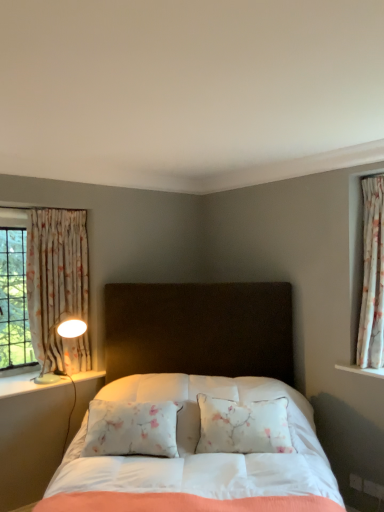
Describe the element at coordinates (198, 405) in the screenshot. I see `white fabric bed at center` at that location.

Image resolution: width=384 pixels, height=512 pixels. Describe the element at coordinates (25, 385) in the screenshot. I see `white glossy lamp at left` at that location.

This screenshot has height=512, width=384. What do you see at coordinates (372, 277) in the screenshot? I see `floral fabric curtain at right, the 1th curtain from the front` at bounding box center [372, 277].

Locate an element on the screen. This screenshot has height=512, width=384. floral fabric curtain at left, which is the 2th curtain in right-to-left order is located at coordinates (55, 271).

In order to click on white fabric bed at center in this screenshot , I will do `click(198, 405)`.

Starting from the white glossy lamp at left, which curtain is the 1st one to the right? Please provide its 2D coordinates.

[(55, 271)]

Does floral fabric curtain at left, which is the 2th curtain in right-to-left order, have a smaller size compared to white glossy lamp at left?

No.

Is floral fabric curtain at left, arranged as the 2th curtain when viewed from the front, touching white glossy lamp at left?

No.

Does floral fabric curtain at right, which is the 2th curtain from back to front, have a greater width compared to white fabric bed at center?

Incorrect, the width of floral fabric curtain at right, which is the 2th curtain from back to front, does not surpass that of white fabric bed at center.

Is floral fabric curtain at right, the 1th curtain from the front, positioned far away from white fabric bed at center?

Absolutely, floral fabric curtain at right, the 1th curtain from the front, is distant from white fabric bed at center.

Consider the image. Which is more to the right, floral fabric curtain at right, which is the 2th curtain from back to front, or white fabric bed at center?

Positioned to the right is floral fabric curtain at right, which is the 2th curtain from back to front.

Is floral fabric curtain at right, which is the second curtain in left-to-right order, turned away from floral fabric curtain at left, which is the first curtain in left-to-right order?

No.

Considering the positions of objects floral fabric curtain at right, arranged as the 1th curtain when viewed from the right, and floral fabric curtain at left, which is the first curtain in left-to-right order, in the image provided, who is more to the right, floral fabric curtain at right, arranged as the 1th curtain when viewed from the right, or floral fabric curtain at left, which is the first curtain in left-to-right order,?

From the viewer's perspective, floral fabric curtain at right, arranged as the 1th curtain when viewed from the right, appears more on the right side.

From a real-world perspective, relative to floral fabric curtain at left, acting as the first curtain starting from the back, is floral fabric curtain at right, the 1th curtain from the front, vertically above or below?

From a real-world perspective, floral fabric curtain at right, the 1th curtain from the front, is physically above floral fabric curtain at left, acting as the first curtain starting from the back.

From the image's perspective, is floral fabric curtain at right, which is the second curtain in left-to-right order, below floral fabric curtain at left, which is the 2th curtain in right-to-left order?

No, from the image's perspective, floral fabric curtain at right, which is the second curtain in left-to-right order, is not below floral fabric curtain at left, which is the 2th curtain in right-to-left order.

Is white fabric bed at center aimed at white glossy lamp at left?

No, white fabric bed at center is not turned towards white glossy lamp at left.

Does point (161, 489) lie behind point (40, 390)?

No.

Which of these two, white fabric bed at center or white glossy lamp at left, is bigger?

white fabric bed at center is bigger.

From the picture: Is white glossy lamp at left far from floral fabric curtain at right, which is the 2th curtain from back to front?

Indeed, white glossy lamp at left is not near floral fabric curtain at right, which is the 2th curtain from back to front.

Is floral fabric curtain at right, the 1th curtain from the front, a part of white glossy lamp at left?

No, white glossy lamp at left does not contain floral fabric curtain at right, the 1th curtain from the front.

Which object is thinner, white glossy lamp at left or floral fabric curtain at right, which is the 2th curtain from back to front?

floral fabric curtain at right, which is the 2th curtain from back to front.

Based on the photo, is white glossy lamp at left facing away from white fabric bed at center?

white glossy lamp at left is not turned away from white fabric bed at center.

Find the location of a particular element. window sill positioned vertically above the white fabric bed at center (from a real-world perspective) is located at coordinates (25, 385).

Between white glossy lamp at left and white fabric bed at center, which one is positioned in front?

white fabric bed at center is more forward.

From the image's perspective, which is below, white fabric bed at center or floral fabric curtain at right, which is the 2th curtain from back to front?

white fabric bed at center is shown below in the image.

Can floral fabric curtain at right, which is the 2th curtain from back to front, be found inside white fabric bed at center?

No, white fabric bed at center does not contain floral fabric curtain at right, which is the 2th curtain from back to front.

Which of these two, white fabric bed at center or floral fabric curtain at right, arranged as the 1th curtain when viewed from the right, is smaller?

floral fabric curtain at right, arranged as the 1th curtain when viewed from the right.

Where is `bed located underneath the floral fabric curtain at right, which is the 2th curtain from back to front (from a real-world perspective)`? Image resolution: width=384 pixels, height=512 pixels. bed located underneath the floral fabric curtain at right, which is the 2th curtain from back to front (from a real-world perspective) is located at coordinates (198, 405).

You are a GUI agent. You are given a task and a screenshot of the screen. Output one action in this format:
    pyautogui.click(x=<x>, y=<y>)
    Task: Click on the window sill on the left side of floral fabric curtain at left, which is the first curtain in left-to-right order
    
    Given the screenshot: What is the action you would take?
    pyautogui.click(x=25, y=385)

Where is `the 2nd curtain directly above the white fabric bed at center (from a real-world perspective)`? This screenshot has height=512, width=384. the 2nd curtain directly above the white fabric bed at center (from a real-world perspective) is located at coordinates (372, 277).

From the image, which object appears to be farther from white fabric bed at center, floral fabric curtain at right, arranged as the 1th curtain when viewed from the right, or white glossy lamp at left?

Based on the image, floral fabric curtain at right, arranged as the 1th curtain when viewed from the right, appears to be further to white fabric bed at center.

Looking at the image, which one is located further to white fabric bed at center, white glossy lamp at left or floral fabric curtain at right, which is the second curtain in left-to-right order?

floral fabric curtain at right, which is the second curtain in left-to-right order, lies further to white fabric bed at center than the other object.

Considering their positions, is floral fabric curtain at left, which is the 2th curtain in right-to-left order, positioned further to white fabric bed at center than white glossy lamp at left?

The object further to white fabric bed at center is floral fabric curtain at left, which is the 2th curtain in right-to-left order.

Which object lies further to the anchor point floral fabric curtain at left, which is the first curtain in left-to-right order, white fabric bed at center or floral fabric curtain at right, which is the second curtain in left-to-right order?

floral fabric curtain at right, which is the second curtain in left-to-right order, is further to floral fabric curtain at left, which is the first curtain in left-to-right order.

When comparing their distances from white glossy lamp at left, does floral fabric curtain at right, arranged as the 1th curtain when viewed from the right, or floral fabric curtain at left, arranged as the 2th curtain when viewed from the front, seem closer?

floral fabric curtain at left, arranged as the 2th curtain when viewed from the front, is closer to white glossy lamp at left.

From the picture: From the image, which object appears to be nearer to white fabric bed at center, floral fabric curtain at right, which is the 2th curtain from back to front, or floral fabric curtain at left, which is the 2th curtain in right-to-left order?

The object closer to white fabric bed at center is floral fabric curtain at right, which is the 2th curtain from back to front.

From the picture: When comparing their distances from floral fabric curtain at left, which is the 2th curtain in right-to-left order, does white glossy lamp at left or floral fabric curtain at right, arranged as the 1th curtain when viewed from the right, seem closer?

Based on the image, white glossy lamp at left appears to be nearer to floral fabric curtain at left, which is the 2th curtain in right-to-left order.

Based on their spatial positions, is floral fabric curtain at right, which is the 2th curtain from back to front, or white fabric bed at center further from floral fabric curtain at left, which is the first curtain in left-to-right order?

The object further to floral fabric curtain at left, which is the first curtain in left-to-right order, is floral fabric curtain at right, which is the 2th curtain from back to front.

You are a GUI agent. You are given a task and a screenshot of the screen. Output one action in this format:
    pyautogui.click(x=<x>, y=<y>)
    Task: Click on the bed situated between white glossy lamp at left and floral fabric curtain at right, which is the second curtain in left-to-right order, from left to right
    
    Given the screenshot: What is the action you would take?
    pyautogui.click(x=198, y=405)

Identify the location of bed between floral fabric curtain at left, which is the 2th curtain in right-to-left order, and floral fabric curtain at right, arranged as the 1th curtain when viewed from the right. click(198, 405).

Identify the location of curtain between white glossy lamp at left and floral fabric curtain at right, which is the second curtain in left-to-right order, in the horizontal direction. This screenshot has height=512, width=384. (55, 271).

You are a GUI agent. You are given a task and a screenshot of the screen. Output one action in this format:
    pyautogui.click(x=<x>, y=<y>)
    Task: Click on the window sill positioned between white fabric bed at center and floral fabric curtain at left, acting as the first curtain starting from the back, from near to far
    
    Given the screenshot: What is the action you would take?
    pyautogui.click(x=25, y=385)